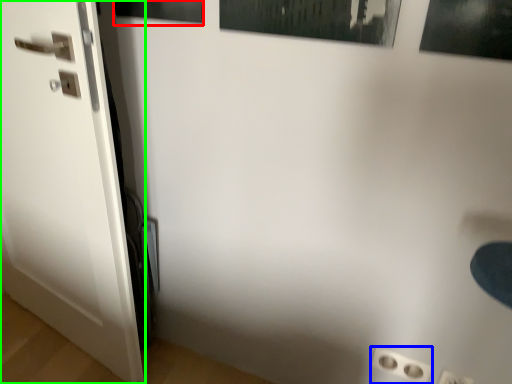
Question: Which object is the farthest from picture frame (highlighted by a red box)? Choose among these: electric outlet (highlighted by a blue box) or door (highlighted by a green box).

Choices:
 (A) electric outlet
 (B) door

Answer: (A)